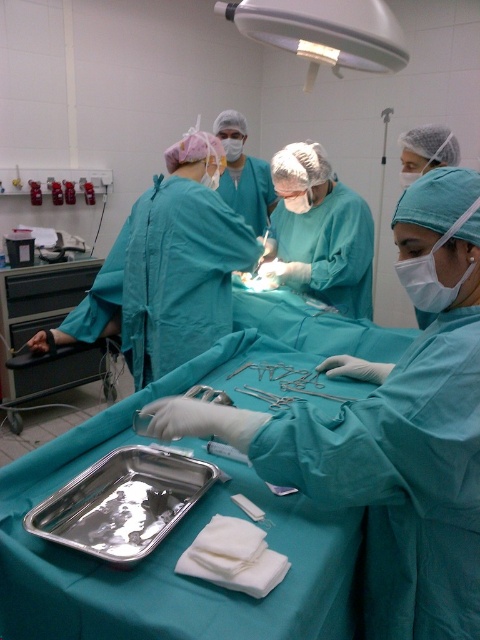
You are a medical intern observing the surgical setup. You need to place a new instrument on the table. The teal matte surgical gown at center is currently occupying space. Can you determine if the satin silver metal forceps at center will fit next to the gown without overlapping?

The teal matte surgical gown at center is wider than the satin silver metal forceps at center, so there should be enough space to place the forceps next to the gown without overlapping.

You are a surgical nurse who needs to quickly grab both the satin silver metal forceps at center and the satin silver scissors at center during a procedure. How far apart are these two instruments from each other?

The satin silver metal forceps at center is 5.16 inches from the satin silver scissors at center, so the distance between them is 5.16 inches.

You are a surgical nurse who needs to quickly access both the teal matte surgical gown at center and the silver metallic tray at lower left during an emergency. Given that you can only move 30 centimeters in one swift motion, can you reach both items without moving your position?

The distance between the teal matte surgical gown at center and the silver metallic tray at lower left is 28.55 centimeters. Since this distance is less than 30 centimeters, you can reach both items without moving your position.